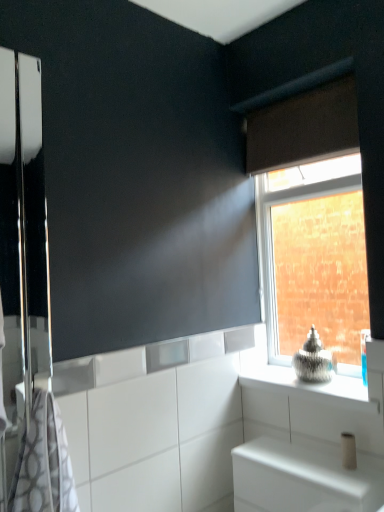
The width and height of the screenshot is (384, 512). Identify the location of free location to the left of white matte toilet paper at lower right. (308, 466).